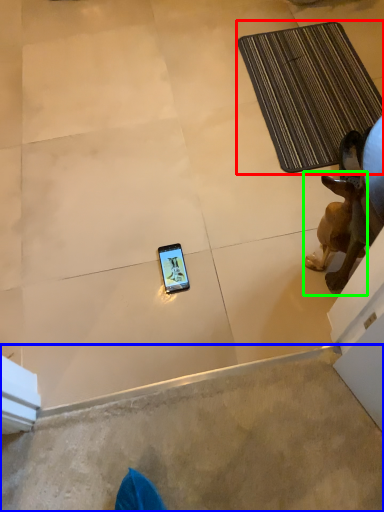
Question: Considering the real-world distances, which object is farthest from bath mat (highlighted by a red box)? concrete (highlighted by a blue box) or dog (highlighted by a green box)?

Choices:
 (A) concrete
 (B) dog

Answer: (A)